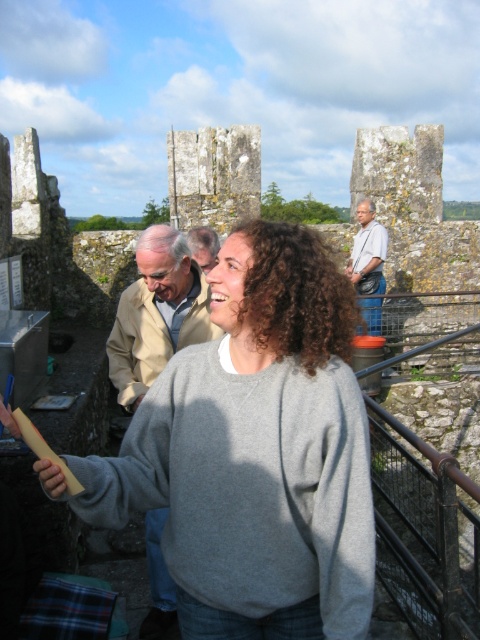
You are a photographer trying to capture the gray cotton sweater at center in your shot. The camera you are using has a fixed focal length and you can only adjust your position. Based on the coordinates provided, where should you position yourself relative to the sweater to ensure it is centered in your photo?

To center the gray cotton sweater at center in your photo, position yourself directly in front of it along the line perpendicular to the camera sensor plane, as the coordinates given are normalized and indicate its central position in the frame.

You are a photographer standing at the historical site. You want to take a photo that includes both the gray cotton sweater at center and the light brown leather jacket at upper right. Which object should you focus on first to ensure both are in sharp focus?

You should focus on the gray cotton sweater at center first because it is closer to the viewer than the light brown leather jacket at upper right, ensuring both will be in focus when using a proper depth of field.